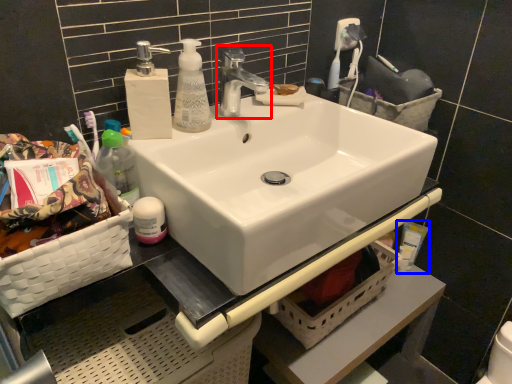
Question: Among these objects, which one is farthest to the camera, tap (highlighted by a red box) or toiletry (highlighted by a blue box)?

Choices:
 (A) tap
 (B) toiletry

Answer: (B)